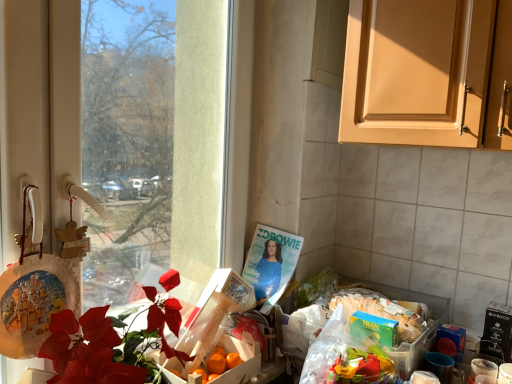
Question: Would you say white glossy coffee cup at lower right is outside transparent glass window at left?

Choices:
 (A) yes
 (B) no

Answer: (A)

Question: Does white glossy coffee cup at lower right have a lesser height compared to transparent glass window at left?

Choices:
 (A) yes
 (B) no

Answer: (A)

Question: Is white glossy coffee cup at lower right next to transparent glass window at left and touching it?

Choices:
 (A) no
 (B) yes

Answer: (A)

Question: From a real-world perspective, does white glossy coffee cup at lower right stand above transparent glass window at left?

Choices:
 (A) no
 (B) yes

Answer: (A)

Question: Is white glossy coffee cup at lower right oriented towards transparent glass window at left?

Choices:
 (A) no
 (B) yes

Answer: (A)

Question: Does point (471, 372) appear closer or farther from the camera than point (212, 342)?

Choices:
 (A) closer
 (B) farther

Answer: (A)

Question: Is white glossy coffee cup at lower right spatially inside wooden crate of oranges at center, which is the 1th box in top-to-bottom order, or outside of it?

Choices:
 (A) outside
 (B) inside

Answer: (A)

Question: Based on their sizes in the image, would you say white glossy coffee cup at lower right is bigger or smaller than wooden crate of oranges at center, which ranks as the 2th box in bottom-to-top order?

Choices:
 (A) small
 (B) big

Answer: (A)

Question: In the image, is white glossy coffee cup at lower right positioned in front of or behind wooden crate of oranges at center, which is the 1th box in top-to-bottom order?

Choices:
 (A) behind
 (B) front

Answer: (B)

Question: In the image, is orange matte box at center, the 2th box when ordered from top to bottom, positioned in front of or behind matte paper magazine at center?

Choices:
 (A) front
 (B) behind

Answer: (A)

Question: In the image, is orange matte box at center, positioned as the first box in bottom-to-top order, on the left side or the right side of matte paper magazine at center?

Choices:
 (A) right
 (B) left

Answer: (B)

Question: From a real-world perspective, relative to matte paper magazine at center, is orange matte box at center, the 2th box when ordered from top to bottom, vertically above or below?

Choices:
 (A) below
 (B) above

Answer: (A)

Question: From the image's perspective, is orange matte box at center, positioned as the first box in bottom-to-top order, above or below matte paper magazine at center?

Choices:
 (A) below
 (B) above

Answer: (A)

Question: Does point (111, 223) appear closer or farther from the camera than point (415, 304)?

Choices:
 (A) closer
 (B) farther

Answer: (B)

Question: Is transparent glass window at left in front of or behind green matte box of tran rice at lower right in the image?

Choices:
 (A) front
 (B) behind

Answer: (A)